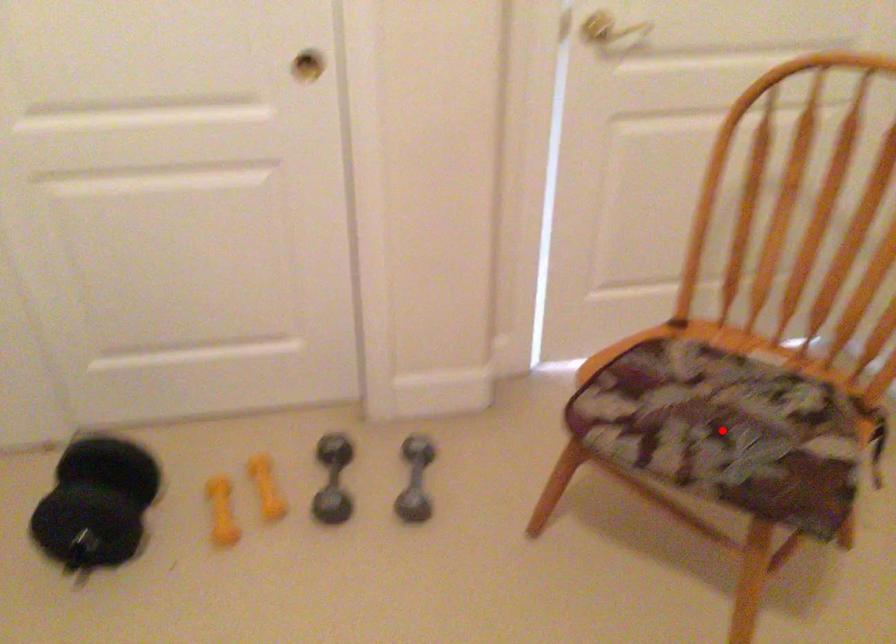
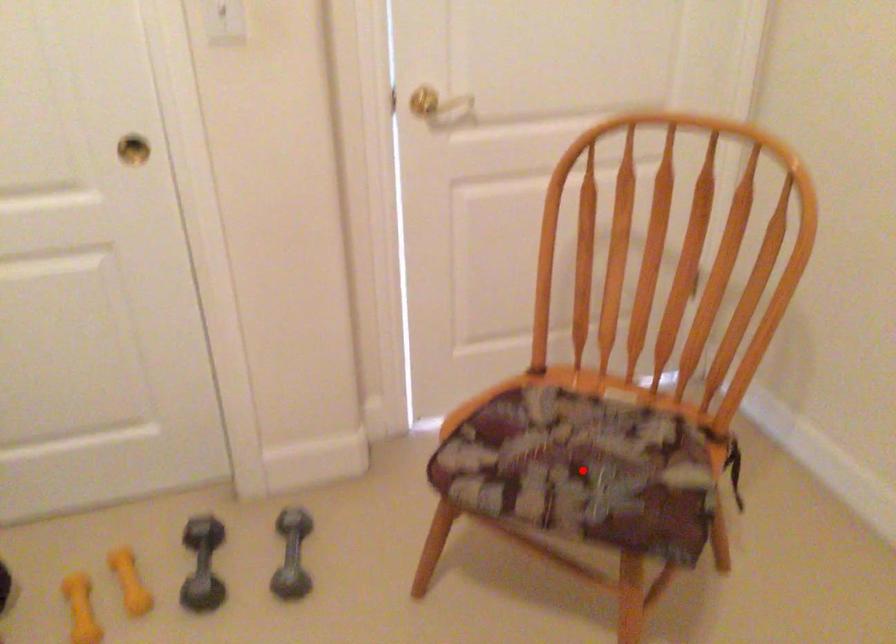
I am providing you with two images of the same scene from different viewpoints. A red point is marked on the first image and another point is marked on the second image. Do the highlighted points in image1 and image2 indicate the same real-world spot?

Yes